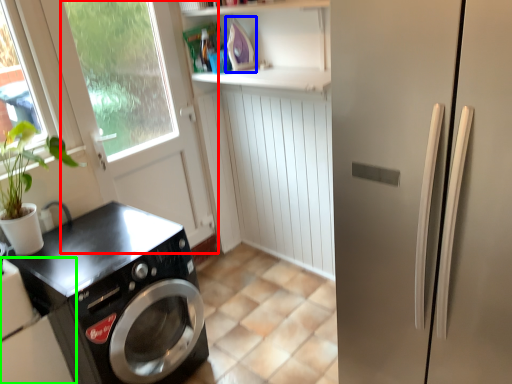
Question: Considering the real-world distances, which object is farthest from screen door (highlighted by a red box)? appliance (highlighted by a blue box) or home appliance (highlighted by a green box)?

Choices:
 (A) appliance
 (B) home appliance

Answer: (B)